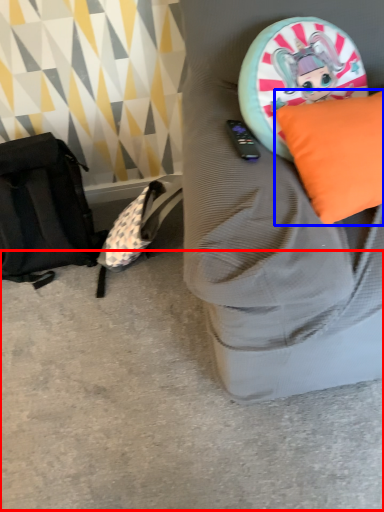
Question: Which point is closer to the camera, concrete (highlighted by a red box) or pillow (highlighted by a blue box)?

Choices:
 (A) concrete
 (B) pillow

Answer: (B)